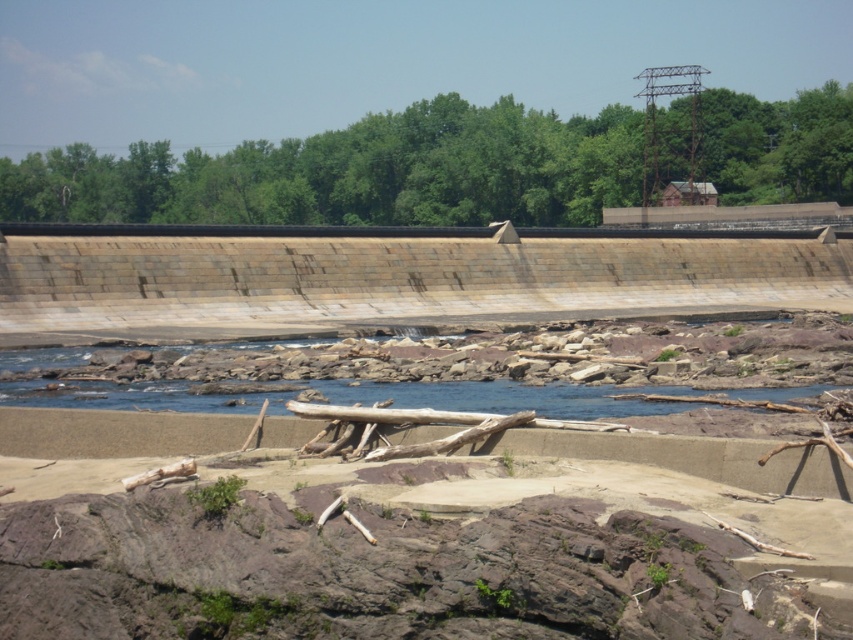
You are a surveyor tasked with marking the exact center of the brown stone dam at center. According to the coordinates provided, where should you place the marker?

The brown stone dam at center should have its exact center marked at the coordinates point (395,275) as specified.

You are a civil engineer inspecting the dam structure. You need to determine if the brown stone dam at center can withstand the current flow of the clear water at center. Based on their widths, what is your assessment?

The brown stone dam at center has a larger width than the clear water at center, which suggests it can effectively manage the water flow and maintain structural integrity.

You are a safety inspector evaluating the dam structure. You notice the brown stone dam at center and the clear water at center in the image. Based on their positions, what potential issue might you identify regarding the dam?

The brown stone dam at center is above clear water at center, which could indicate that the dam is not properly retaining water or there is a risk of water overflow, as the water level is below the dam structure.